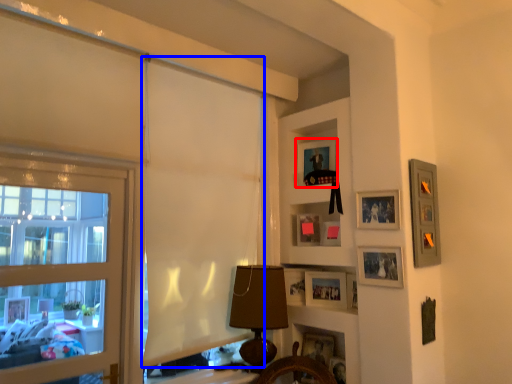
Question: Which point is further to the camera, picture frame (highlighted by a red box) or curtain (highlighted by a blue box)?

Choices:
 (A) picture frame
 (B) curtain

Answer: (A)